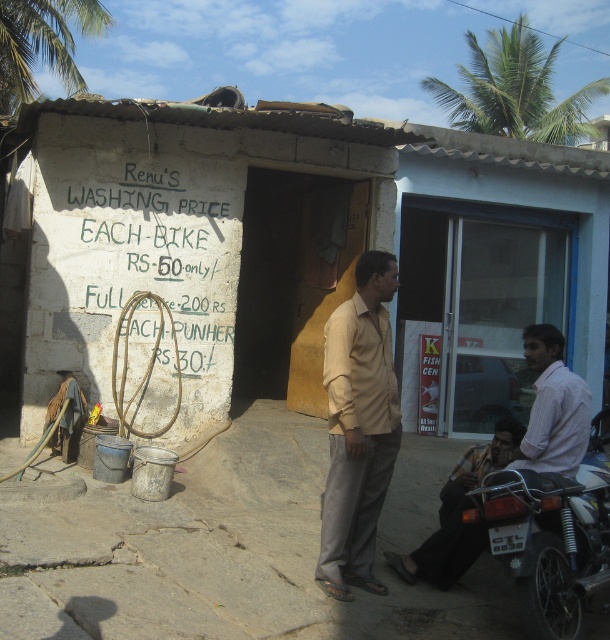
You are standing at the entrance of the building and want to place a new sign on the white concrete wall at center. The sign you have is 1.2 meters wide. Can you fit it horizontally on the wall without overlapping any existing text?

The white concrete wall at center has a width of 9.86 meters, which is significantly larger than the 1.2 meter wide sign. Therefore, the sign can easily be placed horizontally on the wall without overlapping any existing text.

You are a customer arriving at the wash shop and need to park your motorcycle. The white concrete wall at center has an advertisement for washing services. Can the metallic silver motorcycle at lower right fit alongside the wall without overlapping?

The white concrete wall at center has a lesser width compared to the metallic silver motorcycle at lower right. Since the wall is narrower than the motorcycle, the motorcycle cannot fit alongside the wall without overlapping.